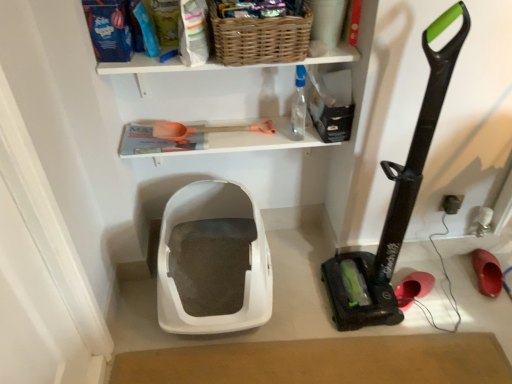
How much space does rubber matte shoe at lower right, which is the first footwear from right to left, occupy horizontally?

The width of rubber matte shoe at lower right, which is the first footwear from right to left, is 8.62 inches.

Describe the element at coordinates (452, 203) in the screenshot. The image size is (512, 384). I see `black plastic electric outlet at lower right` at that location.

Measure the distance between rubberized red shoe at lower right, the first footwear from the left, and camera.

rubberized red shoe at lower right, the first footwear from the left, is 1.64 meters from camera.

In order to face white plastic litter box at center, should I rotate leftwards or rightwards?

You should rotate left by 4.616 degrees.

Measure the distance between point (303, 117) and camera.

Point (303, 117) is 5.20 feet from camera.

The height and width of the screenshot is (384, 512). Find the location of `rubber matte shoe at lower right, the second footwear positioned from the left`. rubber matte shoe at lower right, the second footwear positioned from the left is located at coordinates (487, 272).

Considering their positions, is woven brown basket at upper center located in front of or behind white wicker basket at upper center?

In the image, woven brown basket at upper center appears in front of white wicker basket at upper center.

Considering the positions of point (232, 32) and point (275, 124), is point (232, 32) closer or farther from the camera than point (275, 124)?

Point (232, 32) is positioned closer to the camera compared to point (275, 124).

How different are the orientations of woven brown basket at upper center and white wicker basket at upper center in degrees?

They differ by 1.67 degrees in their facing directions.

Is woven brown basket at upper center at the right side of white wicker basket at upper center?

Indeed, woven brown basket at upper center is positioned on the right side of white wicker basket at upper center.

From the picture: From the image's perspective, which is below, white plastic litter box at center or black plastic vacuum cleaner at right?

white plastic litter box at center appears lower in the image.

The width and height of the screenshot is (512, 384). Find the location of `toilet behind the black plastic vacuum cleaner at right`. toilet behind the black plastic vacuum cleaner at right is located at coordinates (216, 257).

Is white plastic litter box at center taller or shorter than black plastic vacuum cleaner at right?

white plastic litter box at center is shorter than black plastic vacuum cleaner at right.

Is black plastic electric outlet at lower right in contact with white wicker basket at upper center?

No, black plastic electric outlet at lower right is not next to white wicker basket at upper center.

Is black plastic electric outlet at lower right smaller than white wicker basket at upper center?

Yes, black plastic electric outlet at lower right is smaller than white wicker basket at upper center.

Is black plastic electric outlet at lower right not within white wicker basket at upper center?

Indeed, black plastic electric outlet at lower right is completely outside white wicker basket at upper center.

In terms of width, does rubberized red shoe at lower right, the second footwear from the right, look wider or thinner when compared to black plastic vacuum cleaner at right?

In the image, rubberized red shoe at lower right, the second footwear from the right, appears to be more narrow than black plastic vacuum cleaner at right.

Is rubberized red shoe at lower right, the first footwear from the left, bigger than black plastic vacuum cleaner at right?

Actually, rubberized red shoe at lower right, the first footwear from the left, might be smaller than black plastic vacuum cleaner at right.

How many degrees apart are the facing directions of rubberized red shoe at lower right, the second footwear from the right, and black plastic vacuum cleaner at right?

The angle between the facing direction of rubberized red shoe at lower right, the second footwear from the right, and the facing direction of black plastic vacuum cleaner at right is 29.9 degrees.

Is rubberized red shoe at lower right, the first footwear from the left, in front of black plastic vacuum cleaner at right?

No, it is behind black plastic vacuum cleaner at right.

Identify the location of shovel above the rubberized red shoe at lower right, the second footwear from the right (from a real-world perspective). (203, 130).

Would you say orange plastic shovel at upper center contains rubberized red shoe at lower right, the second footwear from the right?

No, rubberized red shoe at lower right, the second footwear from the right, is not inside orange plastic shovel at upper center.

Could you tell me if orange plastic shovel at upper center is facing rubberized red shoe at lower right, the second footwear from the right?

No, orange plastic shovel at upper center is not oriented towards rubberized red shoe at lower right, the second footwear from the right.

Who is smaller, orange plastic shovel at upper center or rubberized red shoe at lower right, the second footwear from the right?

With smaller size is rubberized red shoe at lower right, the second footwear from the right.

Is rubber matte shoe at lower right, the second footwear positioned from the left, inside transparent plastic bottle at upper center?

No, rubber matte shoe at lower right, the second footwear positioned from the left, is not inside transparent plastic bottle at upper center.

From the image's perspective, between transparent plastic bottle at upper center and rubber matte shoe at lower right, which is the first footwear from right to left, who is located below?

rubber matte shoe at lower right, which is the first footwear from right to left, is shown below in the image.

Between transparent plastic bottle at upper center and rubber matte shoe at lower right, the second footwear positioned from the left, which one has smaller width?

With smaller width is transparent plastic bottle at upper center.

Is point (416, 272) behind point (300, 70)?

Yes, it is behind point (300, 70).

From a real-world perspective, is rubberized red shoe at lower right, the second footwear from the right, located higher than transparent plastic bottle at upper center?

Actually, rubberized red shoe at lower right, the second footwear from the right, is physically below transparent plastic bottle at upper center in the real world.

In the scene shown: From the image's perspective, is rubberized red shoe at lower right, the second footwear from the right, beneath transparent plastic bottle at upper center?

Yes.

Where is `basket above the white wicker basket at upper center (from the image's perspective)`? basket above the white wicker basket at upper center (from the image's perspective) is located at coordinates (260, 38).

You are a GUI agent. You are given a task and a screenshot of the screen. Output one action in this format:
    pyautogui.click(x=<x>, y=<y>)
    Task: Click on the toilet below the black plastic vacuum cleaner at right (from the image's perspective)
    The width and height of the screenshot is (512, 384).
    Given the screenshot: What is the action you would take?
    pyautogui.click(x=216, y=257)

From the image, which object appears to be nearer to rubber matte shoe at lower right, which is the first footwear from right to left, transparent plastic bottle at upper center or rubberized red shoe at lower right, the first footwear from the left?

rubberized red shoe at lower right, the first footwear from the left, lies closer to rubber matte shoe at lower right, which is the first footwear from right to left, than the other object.

Estimate the real-world distances between objects in this image. Which object is further from white wicker basket at upper center, transparent plastic bottle at upper center or black plastic electric outlet at lower right?

black plastic electric outlet at lower right is positioned further to the anchor white wicker basket at upper center.

Looking at the image, which one is located closer to woven brown basket at upper center, black plastic electric outlet at lower right or black plastic vacuum cleaner at right?

black plastic vacuum cleaner at right is closer to woven brown basket at upper center.

Which object lies further to the anchor point black plastic vacuum cleaner at right, white plastic litter box at center or woven brown basket at upper center?

woven brown basket at upper center.

Based on their spatial positions, is transparent plastic bottle at upper center or white wicker basket at upper center closer to woven brown basket at upper center?

white wicker basket at upper center is closer to woven brown basket at upper center.

When comparing their distances from black plastic vacuum cleaner at right, does rubber matte shoe at lower right, which is the first footwear from right to left, or black plastic electric outlet at lower right seem closer?

black plastic electric outlet at lower right.

Based on their spatial positions, is white plastic litter box at center or rubber matte shoe at lower right, the second footwear positioned from the left, closer to transparent plastic bottle at upper center?

Among the two, white plastic litter box at center is located nearer to transparent plastic bottle at upper center.

Looking at the image, which one is located closer to woven brown basket at upper center, transparent plastic bottle at upper center or orange plastic shovel at upper center?

transparent plastic bottle at upper center lies closer to woven brown basket at upper center than the other object.

The image size is (512, 384). I want to click on bottle situated between woven brown basket at upper center and black plastic electric outlet at lower right from left to right, so click(x=298, y=105).

Identify the location of bottle between orange plastic shovel at upper center and rubberized red shoe at lower right, the second footwear from the right, from left to right. (298, 105).

Locate an element on the screen. The image size is (512, 384). shelf between orange plastic shovel at upper center and rubberized red shoe at lower right, the second footwear from the right, in the horizontal direction is located at coordinates (213, 65).

Find the location of a particular element. This screenshot has height=384, width=512. bottle between woven brown basket at upper center and rubberized red shoe at lower right, the first footwear from the left, in the vertical direction is located at coordinates (298, 105).